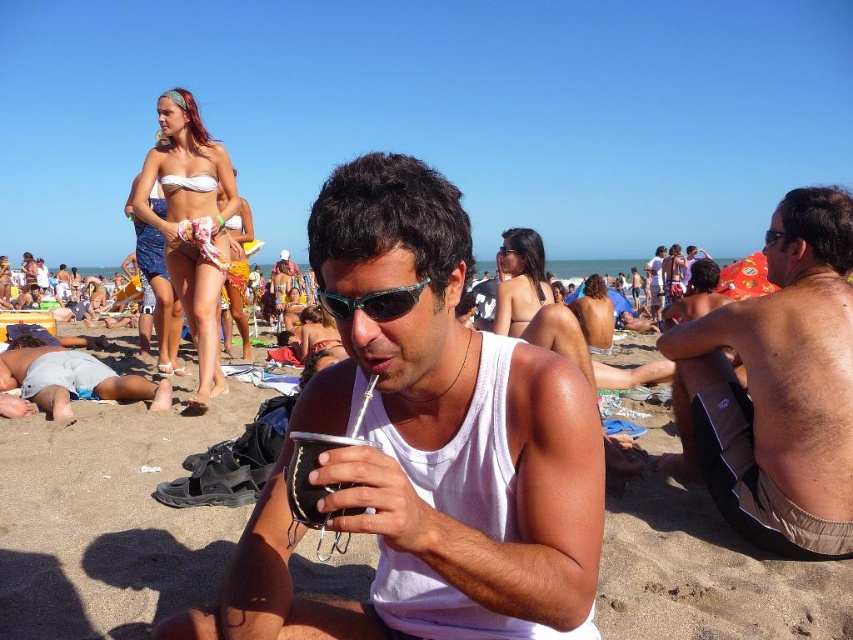
Question: Which of the following is the closest to the observer?

Choices:
 (A) (292, 460)
 (B) (12, 376)
 (C) (358, 305)
 (D) (497, 531)

Answer: (A)

Question: Observing the image, what is the correct spatial positioning of leather-like black gourd at center in reference to sunglasses at center?

Choices:
 (A) right
 (B) left

Answer: (B)

Question: Is light blue denim shorts at lower left wider than sunglasses at center?

Choices:
 (A) no
 (B) yes

Answer: (B)

Question: Which object is closer to the camera taking this photo?

Choices:
 (A) sunglasses at center
 (B) light blue denim shorts at lower left

Answer: (A)

Question: Which point is closer to the camera taking this photo?

Choices:
 (A) (535, 426)
 (B) (332, 301)
 (C) (770, 433)
 (D) (310, 484)

Answer: (D)

Question: Is white matte tank top at center thinner than leather-like black gourd at center?

Choices:
 (A) yes
 (B) no

Answer: (B)